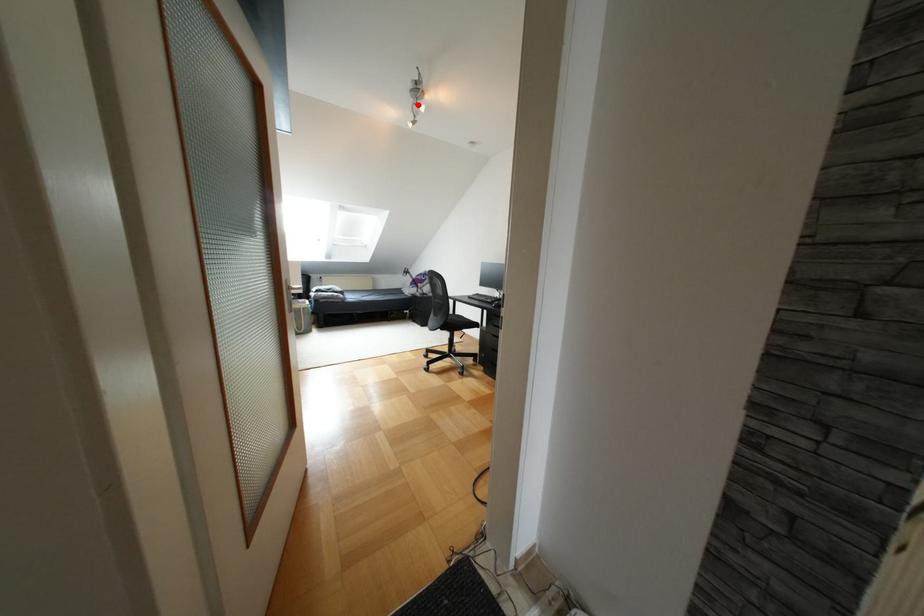
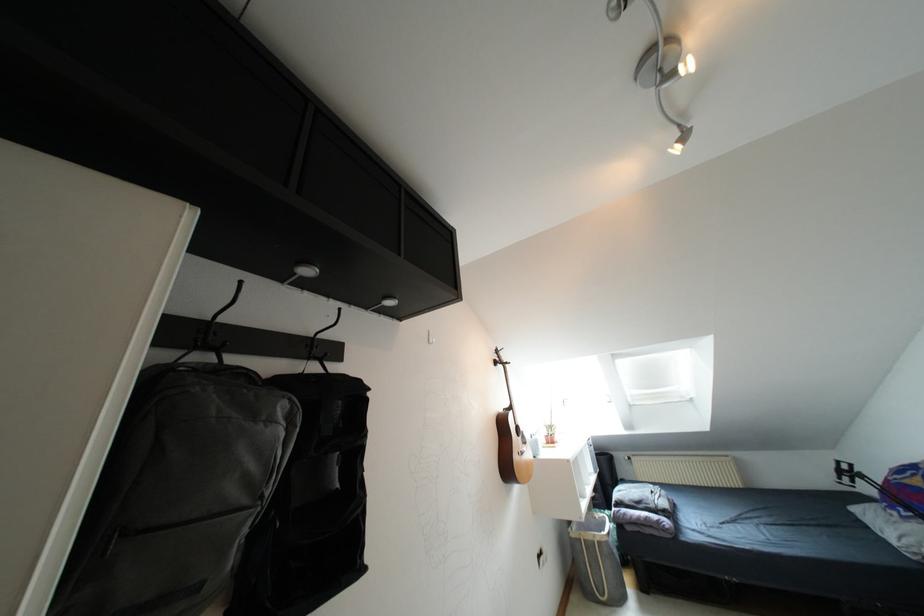
In the second image, find the point that corresponds to the highlighted location in the first image.

(671, 76)